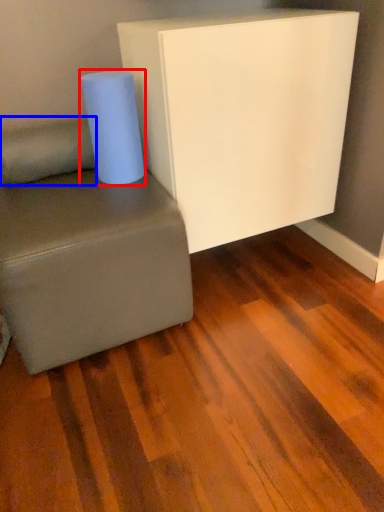
Question: Among these objects, which one is nearest to the camera, paper towel (highlighted by a red box) or pillow (highlighted by a blue box)?

Choices:
 (A) paper towel
 (B) pillow

Answer: (A)